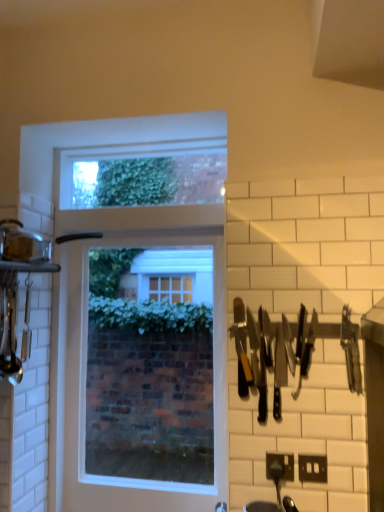
Question: Can you confirm if clear glass window at center is wider than black plastic knives at right?

Choices:
 (A) no
 (B) yes

Answer: (B)

Question: Does clear glass window at center contain black plastic knives at right?

Choices:
 (A) no
 (B) yes

Answer: (A)

Question: Is clear glass window at center far away from black plastic knives at right?

Choices:
 (A) no
 (B) yes

Answer: (A)

Question: From a real-world perspective, does clear glass window at center stand above black plastic knives at right?

Choices:
 (A) no
 (B) yes

Answer: (A)

Question: Can you confirm if clear glass window at center is smaller than black plastic knives at right?

Choices:
 (A) yes
 (B) no

Answer: (B)

Question: Considering their positions, is black plastic knives at right located in front of or behind clear glass window at center?

Choices:
 (A) front
 (B) behind

Answer: (A)

Question: In terms of size, does black plastic knives at right appear bigger or smaller than clear glass window at center?

Choices:
 (A) big
 (B) small

Answer: (B)

Question: From a real-world perspective, is black plastic knives at right positioned above or below clear glass window at center?

Choices:
 (A) above
 (B) below

Answer: (A)

Question: From the image's perspective, relative to clear glass window at center, is black plastic knives at right above or below?

Choices:
 (A) below
 (B) above

Answer: (B)

Question: From a real-world perspective, relative to clear glass window at center, is black plastic electric outlet at lower right vertically above or below?

Choices:
 (A) above
 (B) below

Answer: (B)

Question: Would you say black plastic electric outlet at lower right is inside or outside clear glass window at center?

Choices:
 (A) inside
 (B) outside

Answer: (B)

Question: Considering the positions of black plastic electric outlet at lower right and clear glass window at center in the image, is black plastic electric outlet at lower right bigger or smaller than clear glass window at center?

Choices:
 (A) big
 (B) small

Answer: (B)

Question: Is black plastic electric outlet at lower right in front of or behind clear glass window at center in the image?

Choices:
 (A) behind
 (B) front

Answer: (B)

Question: Considering the positions of black plastic knives at right and black plastic electric outlet at lower right in the image, is black plastic knives at right bigger or smaller than black plastic electric outlet at lower right?

Choices:
 (A) big
 (B) small

Answer: (A)

Question: In terms of width, does black plastic knives at right look wider or thinner when compared to black plastic electric outlet at lower right?

Choices:
 (A) wide
 (B) thin

Answer: (A)